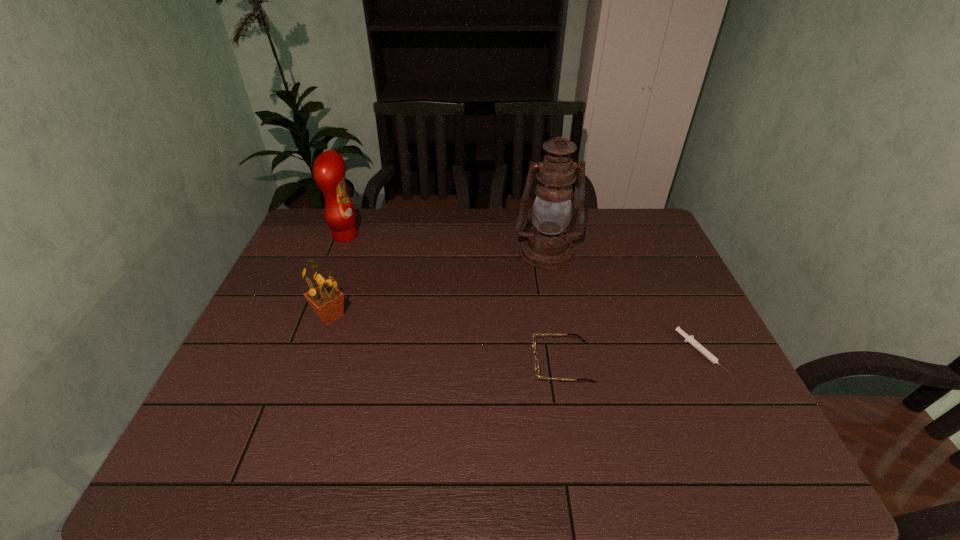
The image size is (960, 540). What are the coordinates of `the tallest object` in the screenshot? It's located at pyautogui.click(x=548, y=245).

Image resolution: width=960 pixels, height=540 pixels. What are the coordinates of `the fourth shortest object` in the screenshot? It's located at (329, 170).

The width and height of the screenshot is (960, 540). Identify the location of the third tallest object. (327, 301).

This screenshot has height=540, width=960. Find the location of `sunflower`. sunflower is located at coordinates (327, 301).

This screenshot has width=960, height=540. Identify the location of spectacles. (536, 334).

Locate an element on the screen. This screenshot has width=960, height=540. the rightmost object is located at coordinates (690, 339).

You are a GUI agent. You are given a task and a screenshot of the screen. Output one action in this format:
    pyautogui.click(x=<x>, y=<y>)
    Task: Click on the shortest object
    The image size is (960, 540).
    Given the screenshot: What is the action you would take?
    pyautogui.click(x=690, y=339)

This screenshot has height=540, width=960. What are the coordinates of `vacant space located on the left of the oil lamp` in the screenshot? It's located at (415, 252).

I want to click on vacant space located on the label side of the condiment, so click(x=373, y=235).

Where is `vacant space located 0.140m at the front of the third tallest object with flowers visible`? Image resolution: width=960 pixels, height=540 pixels. vacant space located 0.140m at the front of the third tallest object with flowers visible is located at coordinates (309, 373).